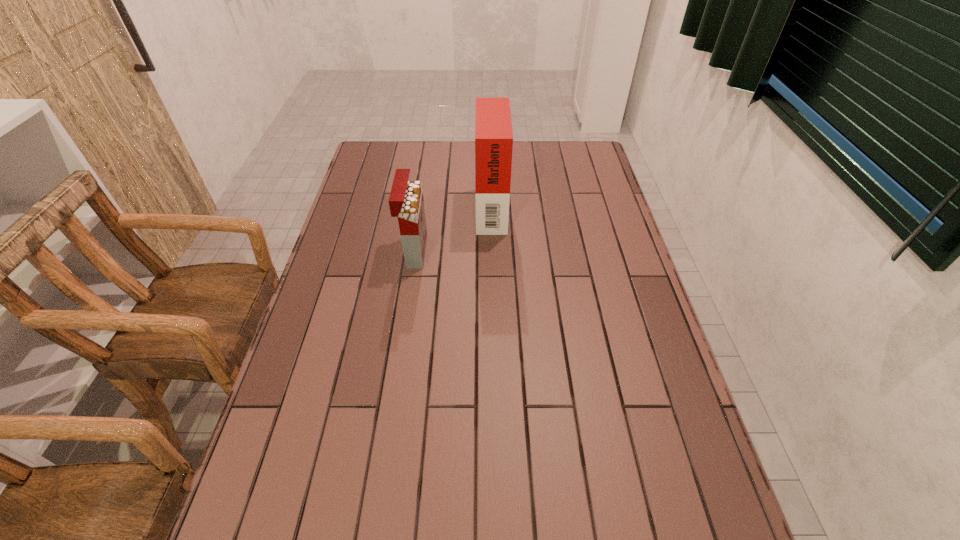
The image size is (960, 540). What are the coordinates of `vacant space at the right edge of the desktop` in the screenshot? It's located at (580, 226).